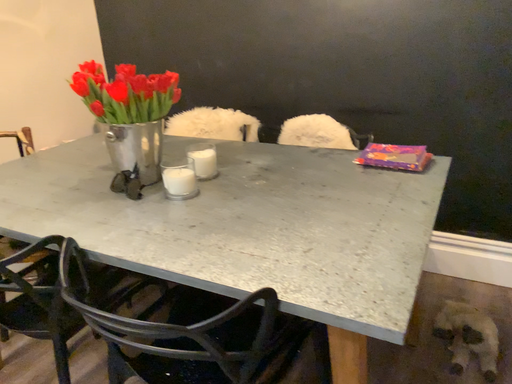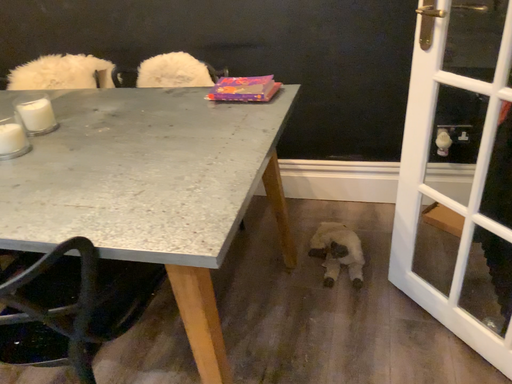
Question: Which way did the camera rotate in the video?

Choices:
 (A) rotated right
 (B) rotated left

Answer: (A)